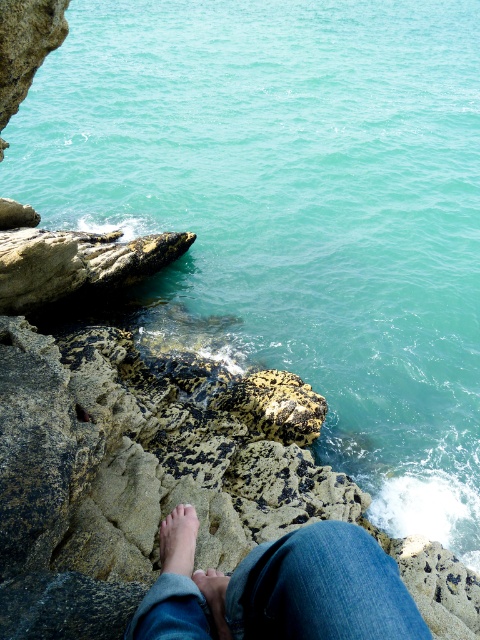
Question: Which object is closer to the camera taking this photo?

Choices:
 (A) light brown skin at center
 (B) blue jeans at lower center
 (C) pink flesh at center

Answer: (B)

Question: Can you confirm if light brown skin at center is smaller than light brown leather foot at lower center?

Choices:
 (A) yes
 (B) no

Answer: (B)

Question: Which object appears farthest from the camera in this image?

Choices:
 (A) light brown skin at center
 (B) pink flesh at center
 (C) blue jeans at lower center

Answer: (B)

Question: Is light brown skin at center positioned in front of pink flesh at center?

Choices:
 (A) yes
 (B) no

Answer: (A)

Question: Which point is closer to the camera?

Choices:
 (A) (192, 572)
 (B) (177, 509)

Answer: (B)

Question: Does light brown leather foot at lower center appear over pink flesh at center?

Choices:
 (A) no
 (B) yes

Answer: (B)